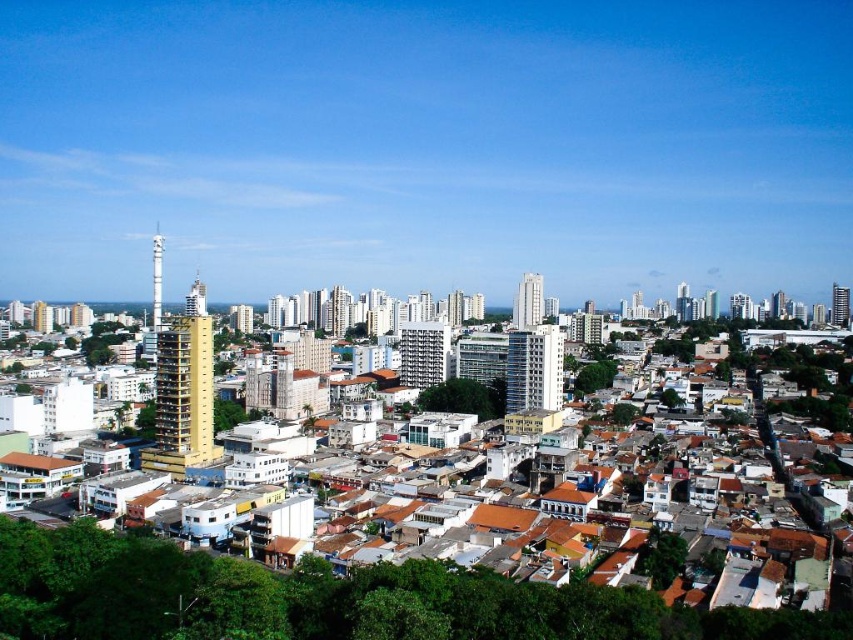
Question: Which object appears farthest from the camera in this image?

Choices:
 (A) white glass building at center
 (B) gold metallic tower at center-left
 (C) gold glass skyscraper at right

Answer: (C)

Question: Which of the following is the closest to the observer?

Choices:
 (A) (508, 372)
 (B) (415, 340)
 (C) (161, 269)
 (D) (833, 296)

Answer: (A)

Question: Which is nearer to the glassy metallic building at center?

Choices:
 (A) gray concrete building at center
 (B) gold metallic tower at center-left
 (C) gold glass skyscraper at right
 (D) smooth glass skyscraper at center

Answer: (A)

Question: Does glassy metallic building at center have a larger size compared to gold glass skyscraper at right?

Choices:
 (A) yes
 (B) no

Answer: (A)

Question: Can you confirm if white glass building at center is positioned below gold glass skyscraper at right?

Choices:
 (A) yes
 (B) no

Answer: (A)

Question: Can you confirm if white glass building at center is positioned to the right of gold metallic tower at center-left?

Choices:
 (A) no
 (B) yes

Answer: (B)